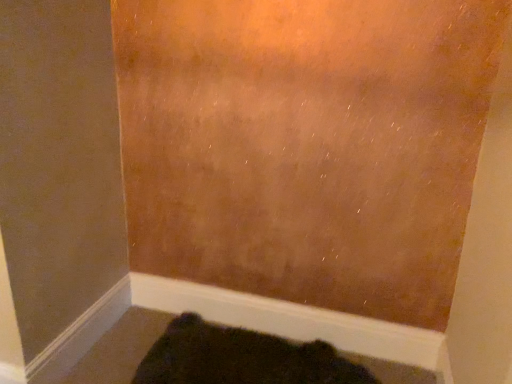
Question: Considering the positions of dark fuzzy rug at lower center and white smooth baseboard at lower center in the image, is dark fuzzy rug at lower center taller or shorter than white smooth baseboard at lower center?

Choices:
 (A) short
 (B) tall

Answer: (A)

Question: In the image, is dark fuzzy rug at lower center positioned in front of or behind white smooth baseboard at lower center?

Choices:
 (A) behind
 (B) front

Answer: (B)

Question: Is dark fuzzy rug at lower center inside or outside of white smooth baseboard at lower center?

Choices:
 (A) outside
 (B) inside

Answer: (A)

Question: From the image's perspective, is white smooth baseboard at lower center above or below dark fuzzy rug at lower center?

Choices:
 (A) above
 (B) below

Answer: (A)

Question: From a real-world perspective, is white smooth baseboard at lower center above or below dark fuzzy rug at lower center?

Choices:
 (A) below
 (B) above

Answer: (B)

Question: Do you think white smooth baseboard at lower center is within dark fuzzy rug at lower center, or outside of it?

Choices:
 (A) inside
 (B) outside

Answer: (B)

Question: Is point (356, 322) positioned closer to the camera than point (161, 355)?

Choices:
 (A) farther
 (B) closer

Answer: (A)